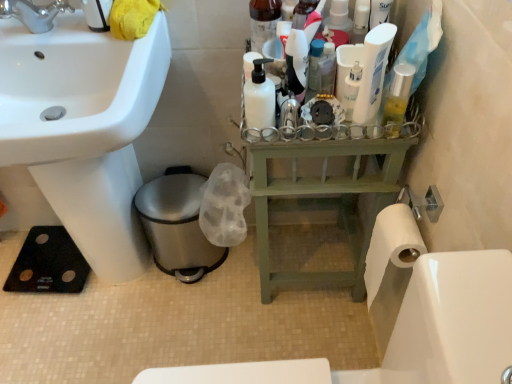
The width and height of the screenshot is (512, 384). Identify the location of free spot below green wood balustrade at center (from a real-world perspective). (297, 251).